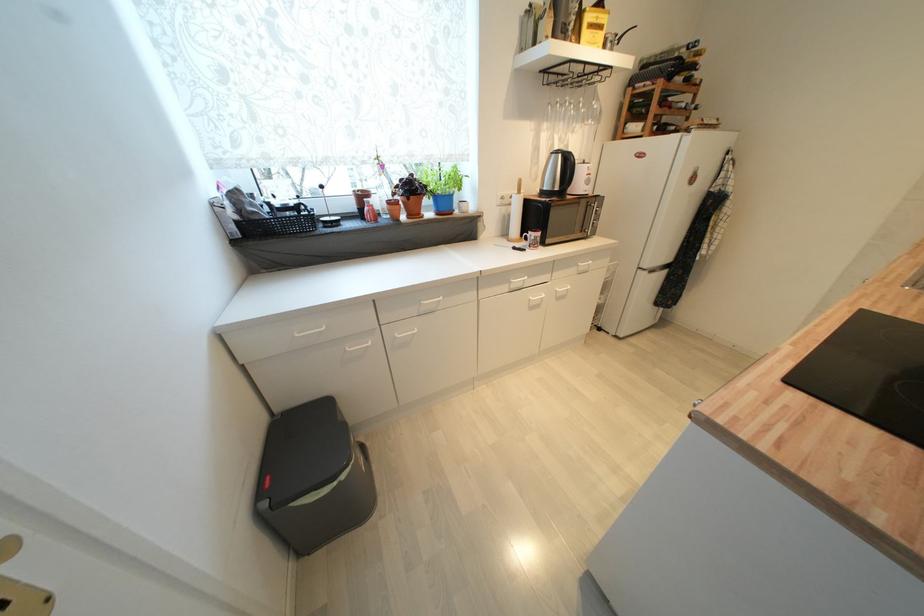
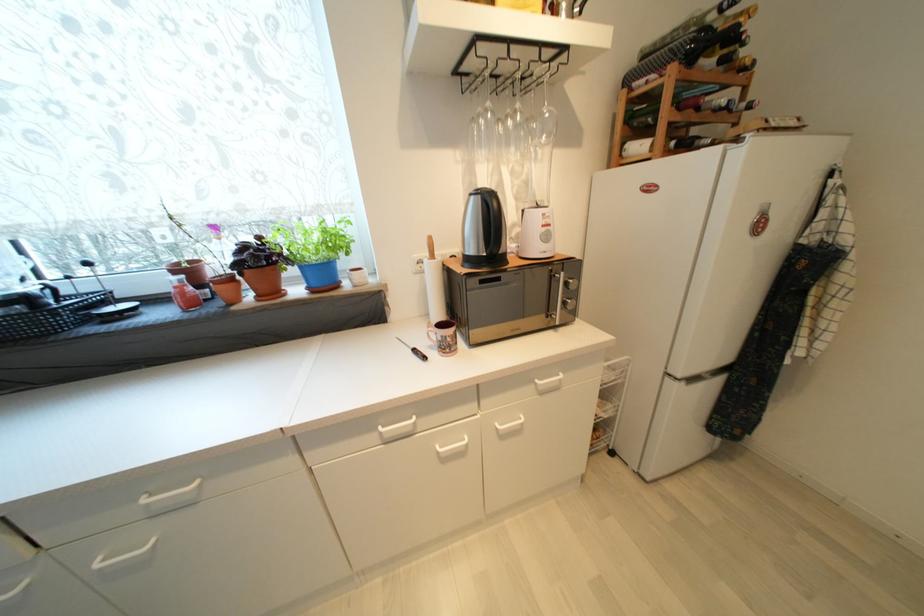
Which direction would the cameraman need to move to produce the second image?

The cameraman moved toward right, forward.